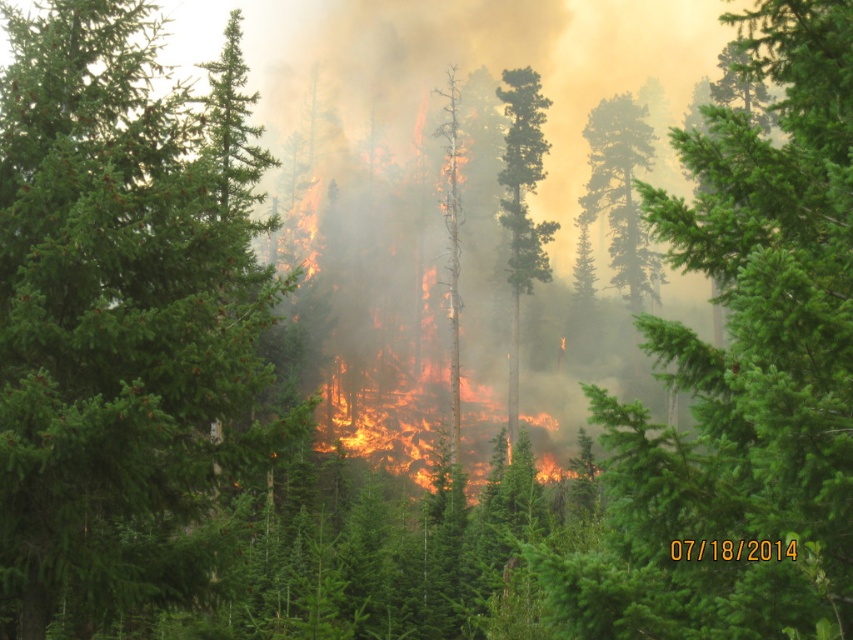
Question: Can you confirm if green evergreen tree at center is wider than green matte tree at center?

Choices:
 (A) no
 (B) yes

Answer: (A)

Question: Which point is farther from the camera taking this photo?

Choices:
 (A) (844, 10)
 (B) (44, 417)
 (C) (519, 97)

Answer: (C)

Question: Does green evergreen tree at center lie behind green smooth bark tree at center?

Choices:
 (A) yes
 (B) no

Answer: (B)

Question: Is green matte tree at center below green smooth bark tree at center?

Choices:
 (A) yes
 (B) no

Answer: (A)

Question: Estimate the real-world distances between objects in this image. Which object is farther from the green matte tree at center?

Choices:
 (A) green evergreen tree at center
 (B) green smooth bark tree at center

Answer: (B)

Question: Which point is closer to the camera taking this photo?

Choices:
 (A) (508, 148)
 (B) (712, 440)
 (C) (242, 288)

Answer: (B)